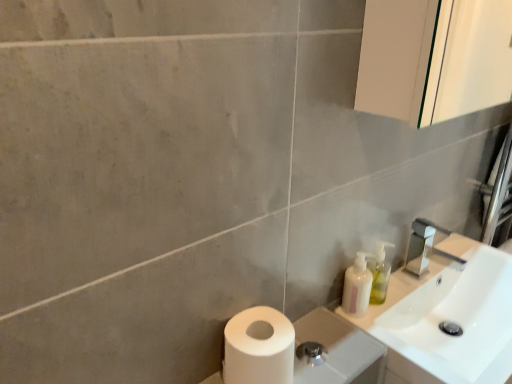
Question: Does white matte toilet paper at lower left appear on the right side of white glossy sink at upper right?

Choices:
 (A) no
 (B) yes

Answer: (A)

Question: Is there a large distance between white matte toilet paper at lower left and white glossy sink at upper right?

Choices:
 (A) yes
 (B) no

Answer: (B)

Question: Can you confirm if white matte toilet paper at lower left is taller than white glossy sink at upper right?

Choices:
 (A) no
 (B) yes

Answer: (A)

Question: Is white matte toilet paper at lower left oriented away from white glossy sink at upper right?

Choices:
 (A) yes
 (B) no

Answer: (B)

Question: Can you see white matte toilet paper at lower left touching white glossy sink at upper right?

Choices:
 (A) no
 (B) yes

Answer: (A)

Question: Is white matte toilet paper at lower left bigger than white glossy sink at upper right?

Choices:
 (A) yes
 (B) no

Answer: (B)

Question: Does translucent plastic soap dispenser at right appear on the left side of white matte toilet paper at lower left?

Choices:
 (A) no
 (B) yes

Answer: (A)

Question: From a real-world perspective, does translucent plastic soap dispenser at right stand above white matte toilet paper at lower left?

Choices:
 (A) yes
 (B) no

Answer: (A)

Question: Does translucent plastic soap dispenser at right have a smaller size compared to white matte toilet paper at lower left?

Choices:
 (A) no
 (B) yes

Answer: (B)

Question: Is translucent plastic soap dispenser at right positioned far away from white matte toilet paper at lower left?

Choices:
 (A) no
 (B) yes

Answer: (A)

Question: Is white matte toilet paper at lower left located within translucent plastic soap dispenser at right?

Choices:
 (A) yes
 (B) no

Answer: (B)

Question: From the image's perspective, is translucent plastic soap dispenser at right over white matte toilet paper at lower left?

Choices:
 (A) no
 (B) yes

Answer: (B)

Question: From the image's perspective, is translucent plastic soap dispenser at right below translucent plastic soap dispenser at right?

Choices:
 (A) no
 (B) yes

Answer: (B)